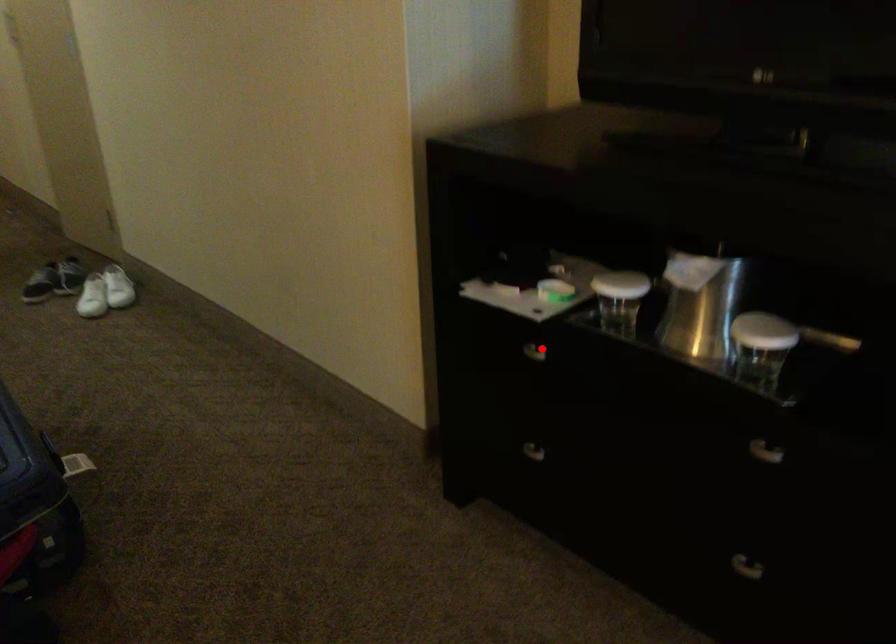
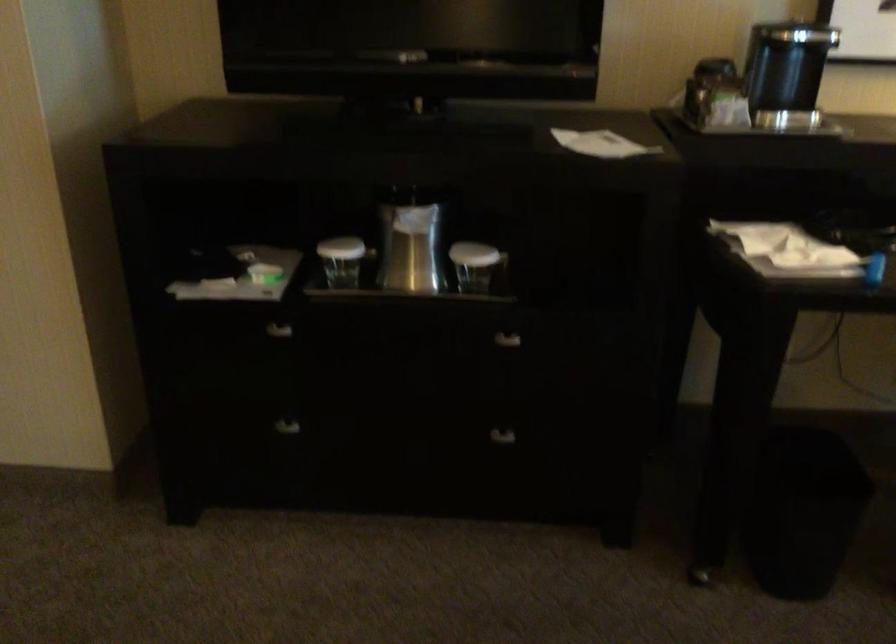
Where in the second image is the point corresponding to the highlighted location from the first image?

(271, 327)